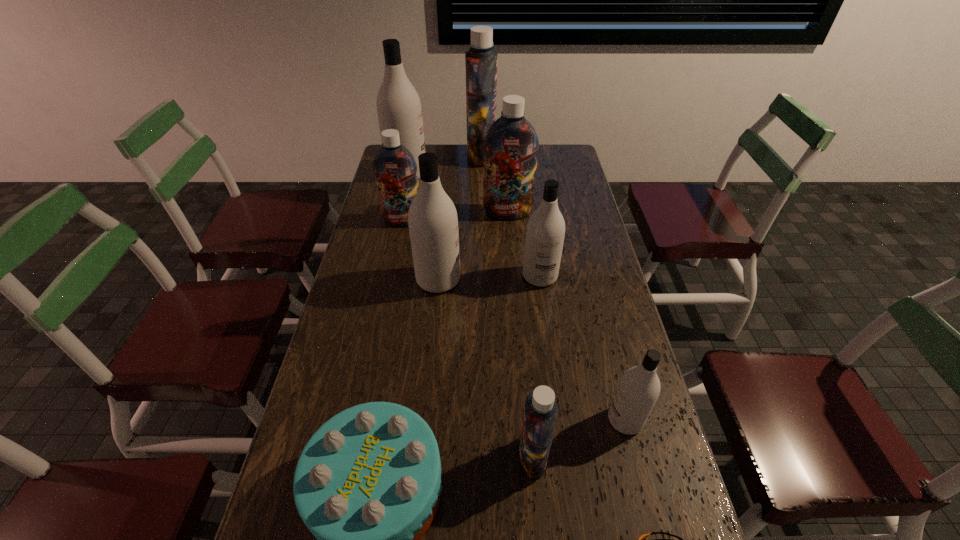
Identify the location of the smallest white shampoo. (638, 390).

Where is `blank area located on the front label of the farthest blue shampoo`? The image size is (960, 540). blank area located on the front label of the farthest blue shampoo is located at coordinates (396, 156).

What are the coordinates of `vacant space located 0.260m on the front label of the farthest blue shampoo` in the screenshot? It's located at (411, 156).

Locate an element on the screen. This screenshot has height=540, width=960. free space located 0.290m on the front label of the farthest blue shampoo is located at coordinates (405, 156).

The width and height of the screenshot is (960, 540). What are the coordinates of `vacant space located 0.120m on the front-facing side of the leftmost white shampoo` in the screenshot? It's located at (455, 174).

You are a GUI agent. You are given a task and a screenshot of the screen. Output one action in this format:
    pyautogui.click(x=<x>, y=<y>)
    Task: Click on the vacant space situated on the front-facing side of the sixth shampoo from right to left
    This screenshot has width=960, height=540.
    Given the screenshot: What is the action you would take?
    pyautogui.click(x=540, y=280)

Where is `vacant space located on the front label of the second biggest blue shampoo`? vacant space located on the front label of the second biggest blue shampoo is located at coordinates (x=511, y=254).

Locate an element on the screen. The height and width of the screenshot is (540, 960). free space located on the front-facing side of the second white shampoo from right to left is located at coordinates (545, 318).

You are a GUI agent. You are given a task and a screenshot of the screen. Output one action in this format:
    pyautogui.click(x=<x>, y=<y>)
    Task: Click on the vacant region located on the front label of the third biggest blue shampoo
    
    Given the screenshot: What is the action you would take?
    pyautogui.click(x=396, y=251)

Where is `free space located on the front label of the nearest blue shampoo`? free space located on the front label of the nearest blue shampoo is located at coordinates (476, 457).